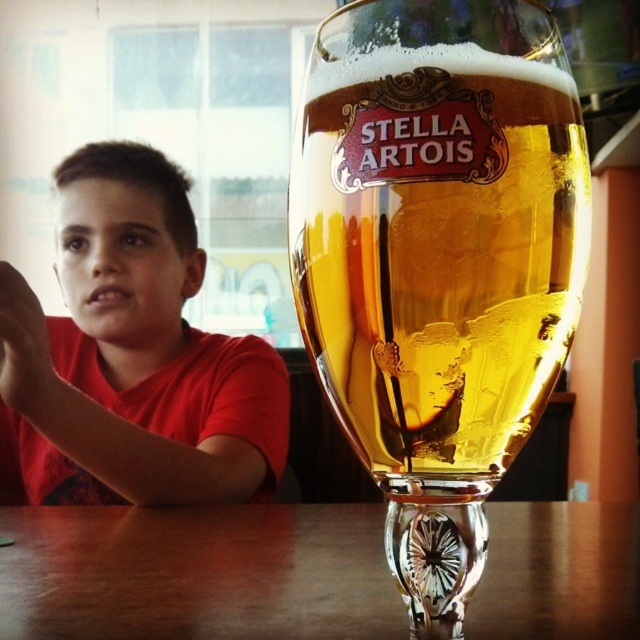
You are a bartender preparing a drink order. The customer has requested a Stella Artois beer and specified that it should be placed exactly at coordinate point 0.408, 0.684 on the table. You have the clear glass stella artois beer glass at center in front of you. Can you confirm if placing the beer in the glass at its current position will meet the customer request?

The clear glass stella artois beer glass at center is already positioned at point (x=436, y=260), so placing the beer in the glass at its current position will meet the customer request.